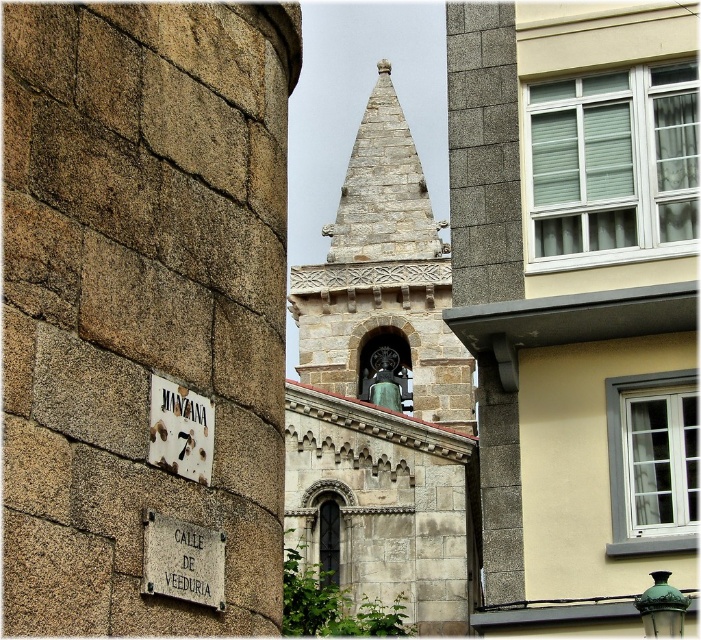
Measure the distance from stone textured spire at center to white stone sign at center.

stone textured spire at center is 77.05 meters from white stone sign at center.

Is point (348, 179) more distant than point (198, 561)?

That is True.

The height and width of the screenshot is (640, 701). Describe the element at coordinates (383, 189) in the screenshot. I see `stone textured spire at center` at that location.

The image size is (701, 640). Identify the location of stone textured spire at center. 383,189.

Which is above, white stone sign at center or white metal sign at lower left?

white metal sign at lower left is above.

Does point (170, 550) come farther from viewer compared to point (151, 378)?

No, (170, 550) is closer to viewer.

Identify the location of white stone sign at center. (182, 561).

Between gray stone church steeple at center and white stone sign at center, which one appears on the left side from the viewer's perspective?

white stone sign at center

Does gray stone church steeple at center appear on the right side of white stone sign at center?

Yes, gray stone church steeple at center is to the right of white stone sign at center.

Describe the element at coordinates (383, 394) in the screenshot. This screenshot has height=640, width=701. I see `gray stone church steeple at center` at that location.

Locate an element on the screen. This screenshot has height=640, width=701. gray stone church steeple at center is located at coordinates (383, 394).